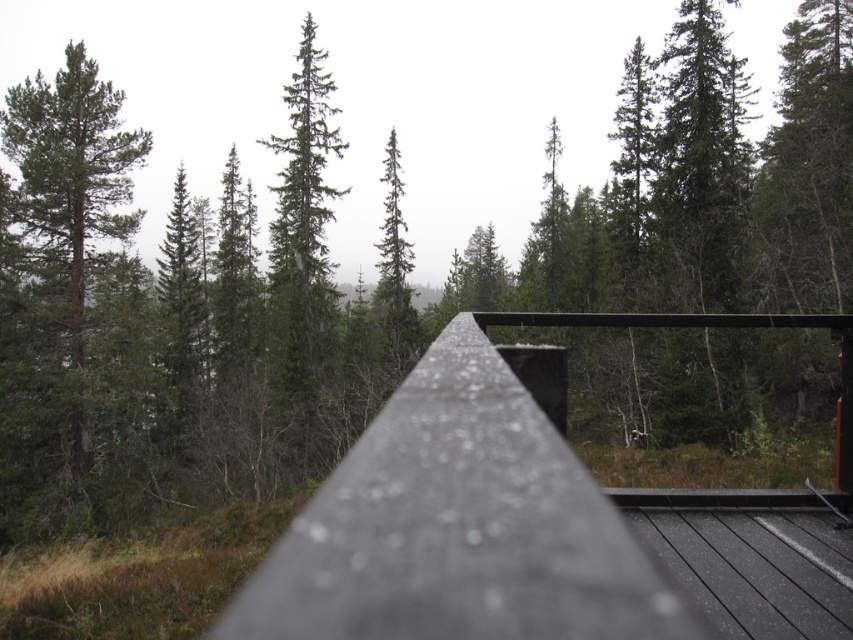
Question: Among these points, which one is nearest to the camera?

Choices:
 (A) (699, 572)
 (B) (73, 157)

Answer: (A)

Question: Which object appears closest to the camera in this image?

Choices:
 (A) smooth black deck at center
 (B) green matte tree at left

Answer: (A)

Question: Can you confirm if smooth black deck at center is positioned below green matte tree at left?

Choices:
 (A) no
 (B) yes

Answer: (B)

Question: Where is smooth black deck at center located in relation to green matte tree at left in the image?

Choices:
 (A) below
 (B) above

Answer: (A)

Question: Can you confirm if smooth black deck at center is positioned to the left of green matte tree at left?

Choices:
 (A) yes
 (B) no

Answer: (B)